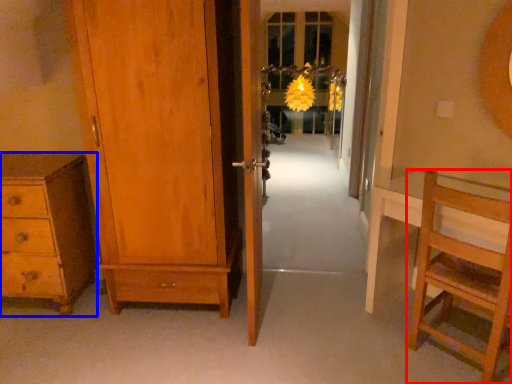
Question: Which object is further to the camera taking this photo, furniture (highlighted by a red box) or chest of drawers (highlighted by a blue box)?

Choices:
 (A) furniture
 (B) chest of drawers

Answer: (B)